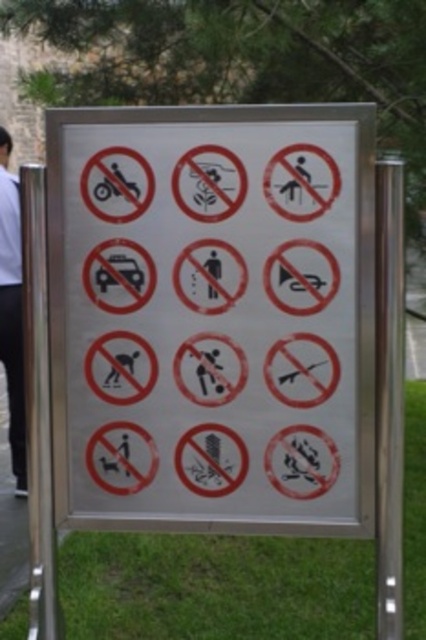
Who is positioned more to the left, white metallic signboard at center or white shirt at left?

Positioned to the left is white shirt at left.

In the scene shown: Who is more forward, (100,195) or (19,433)?

Positioned in front is point (100,195).

Identify the location of white metallic signboard at center. Image resolution: width=426 pixels, height=640 pixels. (213, 317).